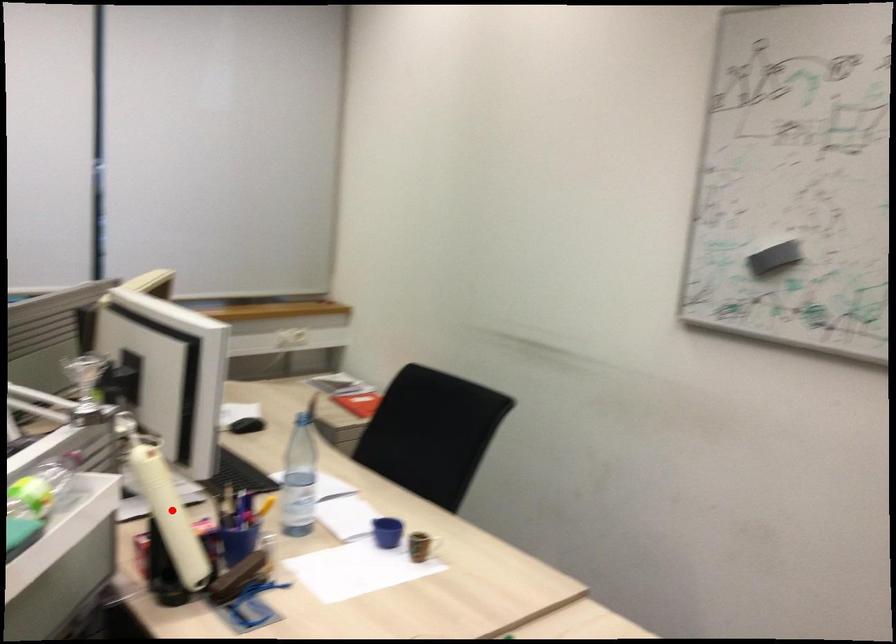
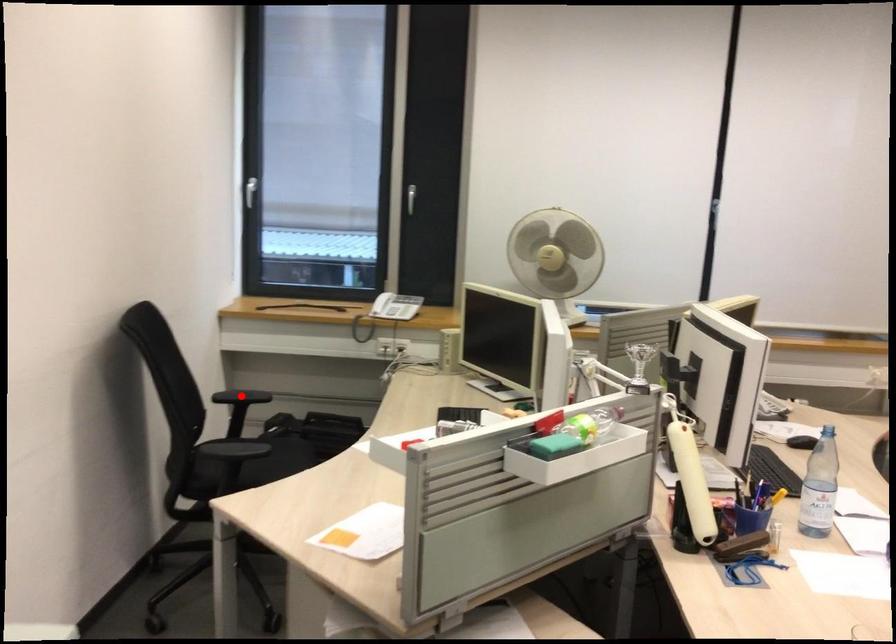
I am providing you with two images of the same scene from different viewpoints. A red point is marked on the first image and another point is marked on the second image. Do the highlighted points in image1 and image2 indicate the same real-world spot?

No